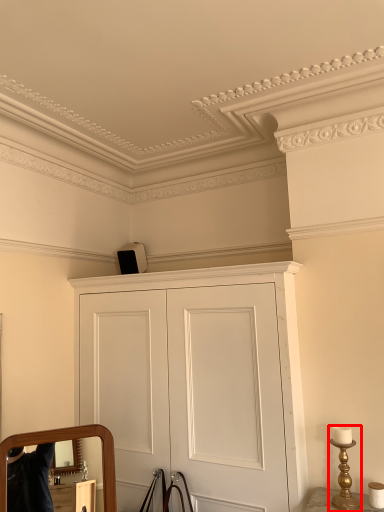
Question: From the image's perspective, what is the correct spatial relationship of table lamp (annotated by the red box) in relation to cupboard?

Choices:
 (A) below
 (B) above

Answer: (A)